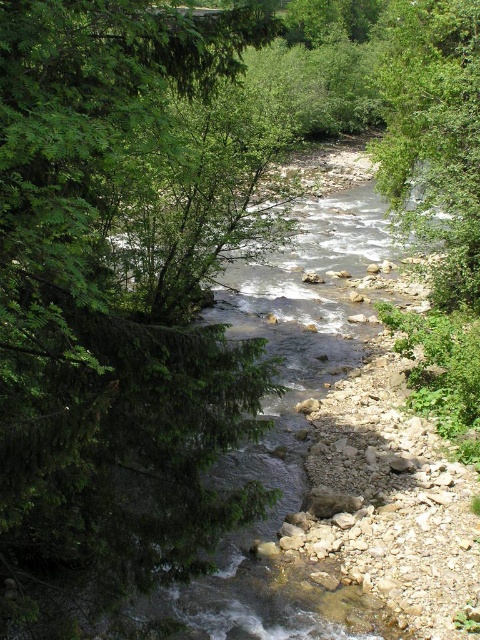
Question: Which of the following is the closest to the observer?

Choices:
 (A) pyautogui.click(x=75, y=221)
 (B) pyautogui.click(x=410, y=218)

Answer: (A)

Question: Does green leafy tree at left appear under green leafy tree at right?

Choices:
 (A) no
 (B) yes

Answer: (B)

Question: Is green leafy tree at left behind green leafy tree at right?

Choices:
 (A) yes
 (B) no

Answer: (B)

Question: Which of the following is the farthest from the observer?

Choices:
 (A) green leafy tree at right
 (B) green leafy tree at left

Answer: (A)

Question: Where is green leafy tree at left located in relation to green leafy tree at right in the image?

Choices:
 (A) left
 (B) right

Answer: (A)